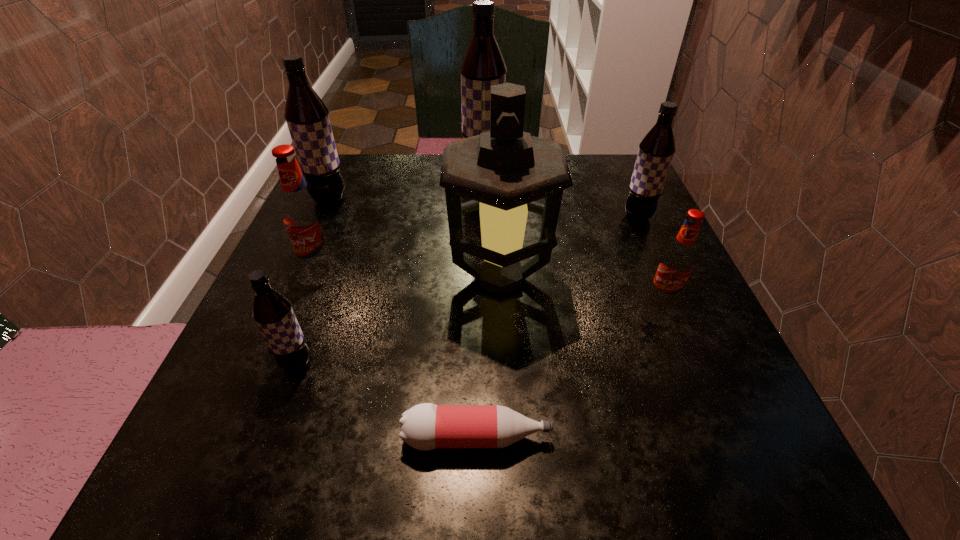
The height and width of the screenshot is (540, 960). Find the location of `free point located with the cap open on the shortest object`. free point located with the cap open on the shortest object is located at coordinates (742, 437).

Where is `object situated at the near edge`? object situated at the near edge is located at coordinates (426, 426).

The width and height of the screenshot is (960, 540). What are the coordinates of `object that is at the far left corner` in the screenshot? It's located at (307, 117).

Find the location of `object at the far right corner`. object at the far right corner is located at coordinates (656, 150).

In the image, there is a desktop. Where is `vacant space at the far edge`? vacant space at the far edge is located at coordinates (417, 199).

In the image, there is a desktop. Where is `vacant space at the near edge`? Image resolution: width=960 pixels, height=540 pixels. vacant space at the near edge is located at coordinates (402, 448).

At what (x,y) coordinates should I click in order to perform the action: click on vacant space at the left edge of the desktop. Please return your answer as a coordinate pair (x, y). Image resolution: width=960 pixels, height=540 pixels. Looking at the image, I should click on (338, 252).

This screenshot has width=960, height=540. In order to click on blank space at the right edge of the desktop in this screenshot , I will do `click(631, 264)`.

Image resolution: width=960 pixels, height=540 pixels. In order to click on free space at the far right corner of the desktop in this screenshot , I will do `click(619, 176)`.

The width and height of the screenshot is (960, 540). Find the location of `free space that is in between the shortest object and the third root beer from right to left`. free space that is in between the shortest object and the third root beer from right to left is located at coordinates (480, 304).